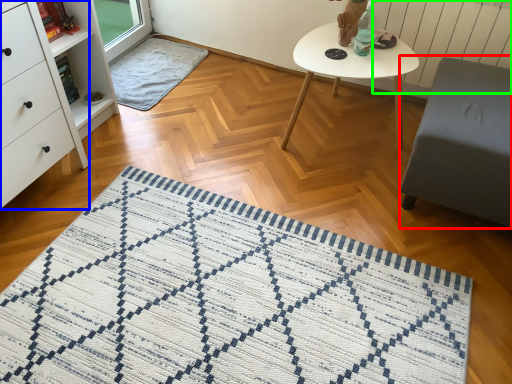
Question: Which is nearer to the swivel chair (highlighted by a red box)? chest of drawers (highlighted by a blue box) or radiator (highlighted by a green box).

Choices:
 (A) chest of drawers
 (B) radiator

Answer: (B)